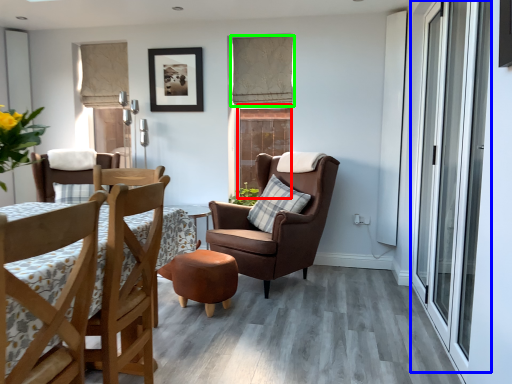
Question: Which is nearer to the window (highlighted by a red box)? screen door (highlighted by a blue box) or curtain (highlighted by a green box).

Choices:
 (A) screen door
 (B) curtain

Answer: (B)